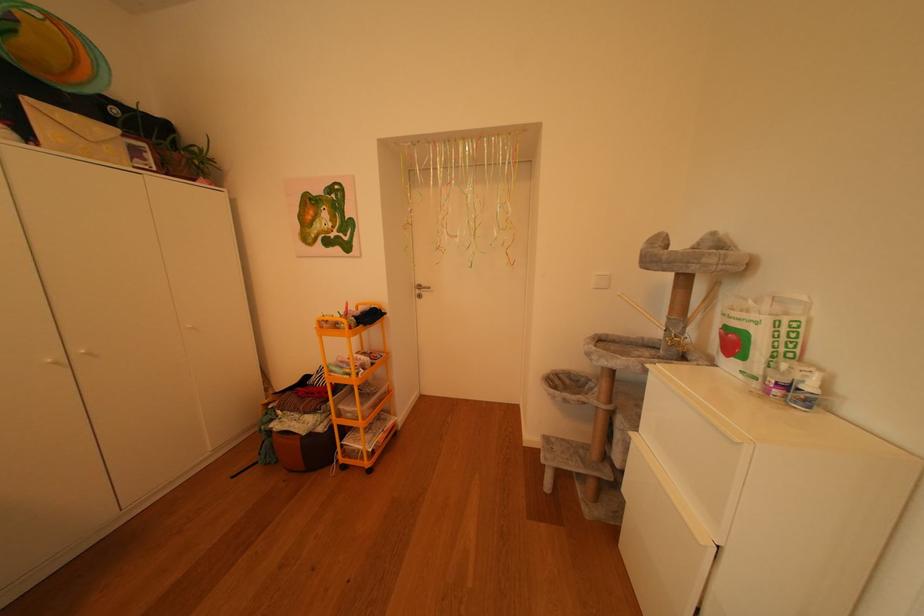
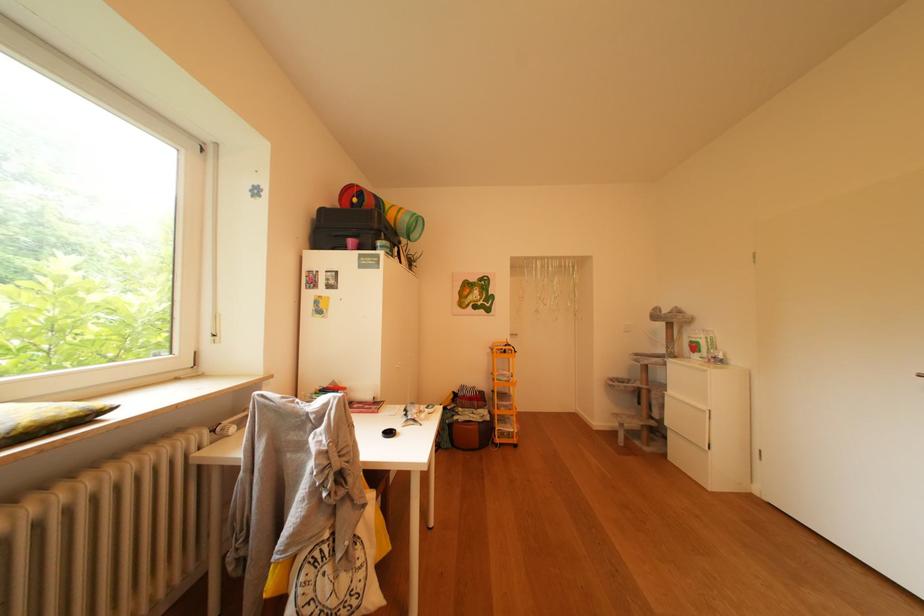
From the picture: The images are taken continuously from a first-person perspective. In which direction are you moving?

The cameraman walked toward left, backward.